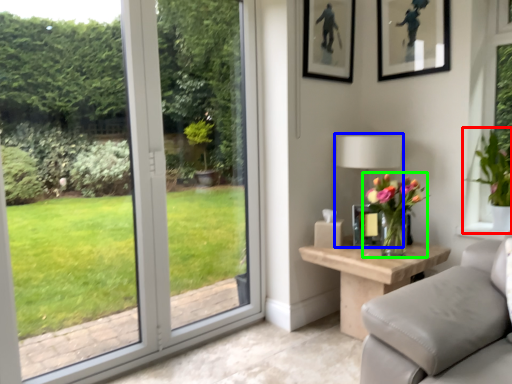
Question: Which object is positioned closest to houseplant (highlighted by a red box)? Select from table lamp (highlighted by a blue box) and houseplant (highlighted by a green box).

Choices:
 (A) table lamp
 (B) houseplant

Answer: (A)